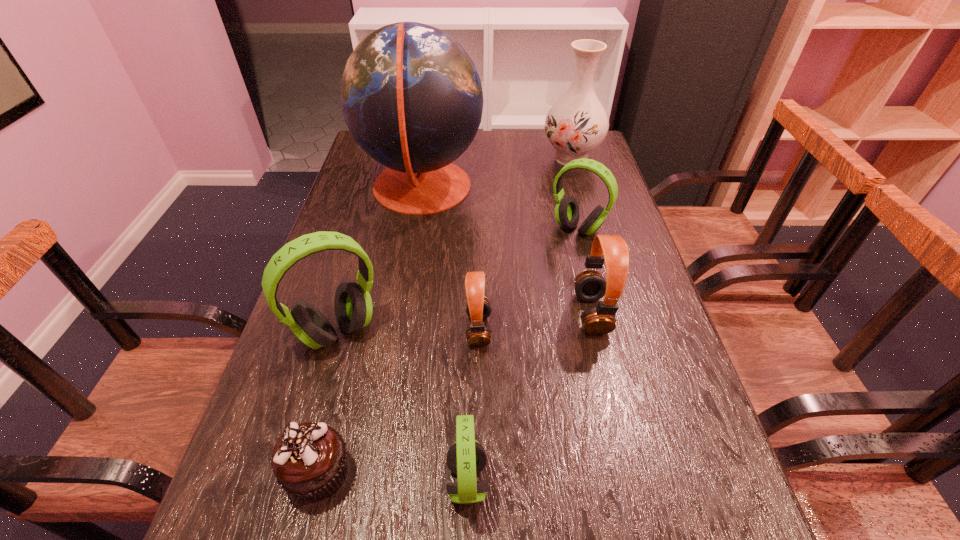
The image size is (960, 540). Identify the location of blank space located 0.130m on the left of the nearest green headset. (369, 481).

Where is `free space located on the back of the brown cupcake`? The width and height of the screenshot is (960, 540). free space located on the back of the brown cupcake is located at coordinates (338, 400).

Identify the location of globe positioned at the far edge. (411, 96).

Identify the location of vase that is at the far edge. (577, 123).

This screenshot has width=960, height=540. In order to click on globe at the left edge in this screenshot , I will do `click(411, 96)`.

Identify the location of headset present at the left edge. Image resolution: width=960 pixels, height=540 pixels. (353, 307).

The height and width of the screenshot is (540, 960). I want to click on cupcake positioned at the left edge, so coord(309,460).

Where is `vase that is at the right edge`? vase that is at the right edge is located at coordinates (577, 123).

Locate an element on the screen. The image size is (960, 540). object at the far left corner is located at coordinates (411, 96).

Where is `object positioned at the far right corner`? The width and height of the screenshot is (960, 540). object positioned at the far right corner is located at coordinates (577, 123).